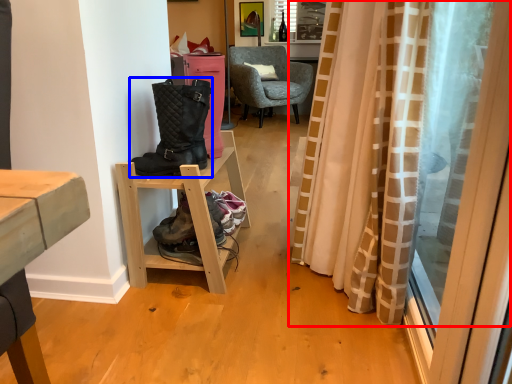
Question: Which of the following is the closest to the observer, curtain (highlighted by a red box) or boots (highlighted by a blue box)?

Choices:
 (A) curtain
 (B) boots

Answer: (A)